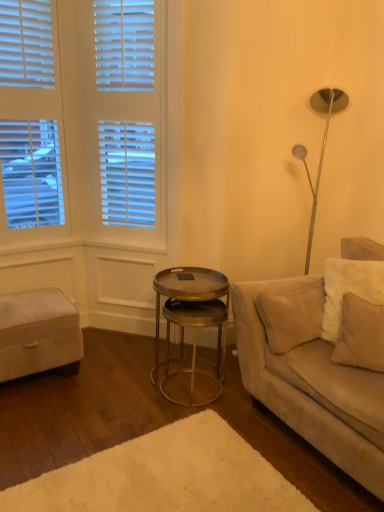
Where is `vacant region above white fabric ottoman at lower left (from a real-world perspective)`? The height and width of the screenshot is (512, 384). vacant region above white fabric ottoman at lower left (from a real-world perspective) is located at coordinates click(x=27, y=306).